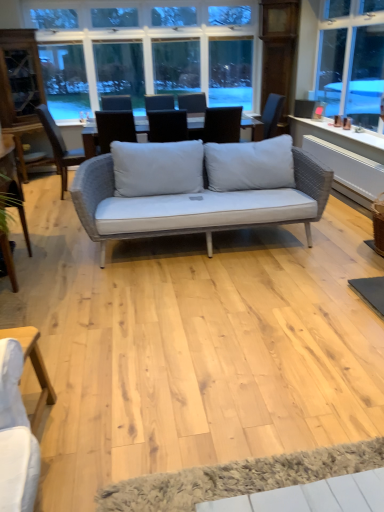
Where is `free location to the right of light wood table at lower left`? The height and width of the screenshot is (512, 384). free location to the right of light wood table at lower left is located at coordinates (83, 436).